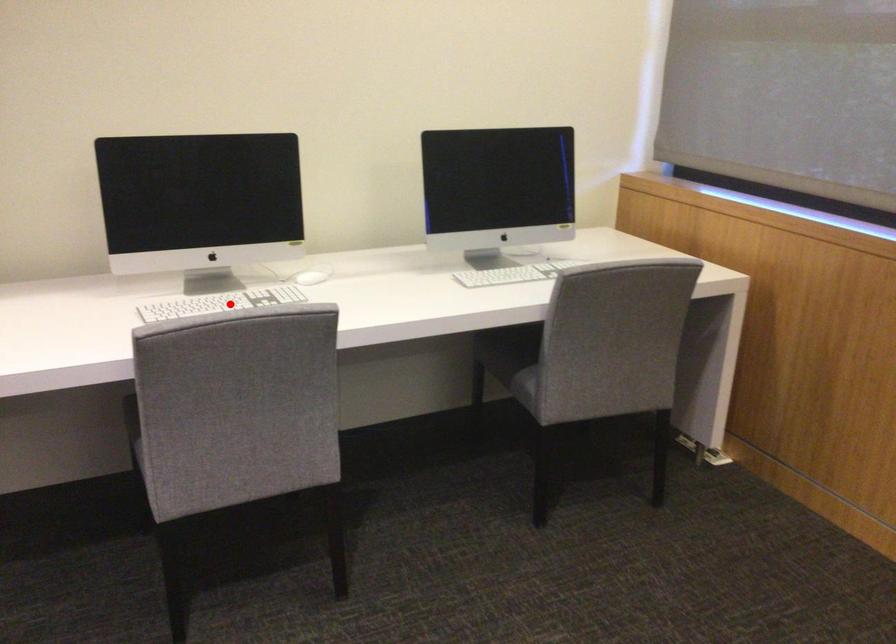
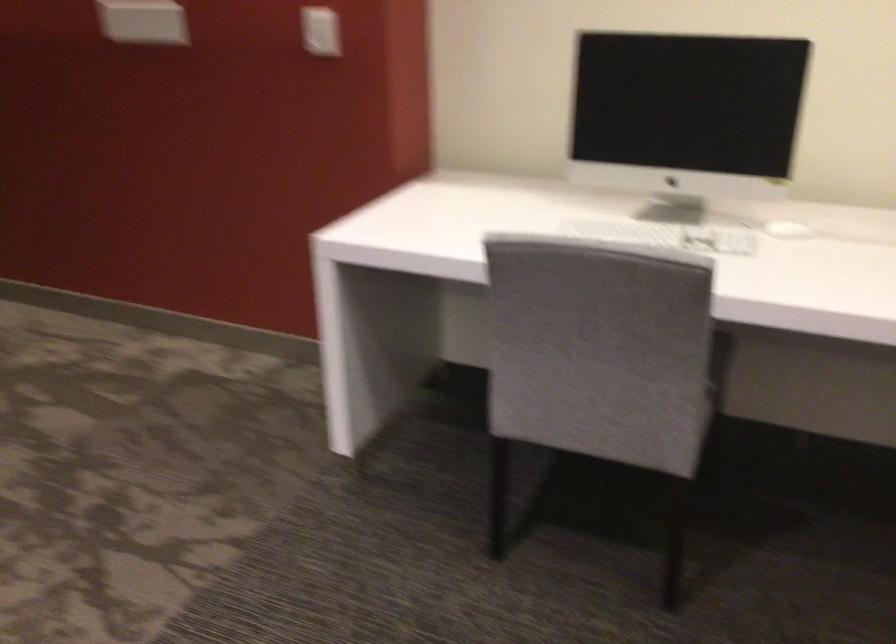
Question: I am providing you with two images of the same scene from different viewpoints. A red point is shown in image1. For the corresponding object point in image2, is it positioned nearer or farther from the camera?

Choices:
 (A) Nearer
 (B) Farther

Answer: (A)